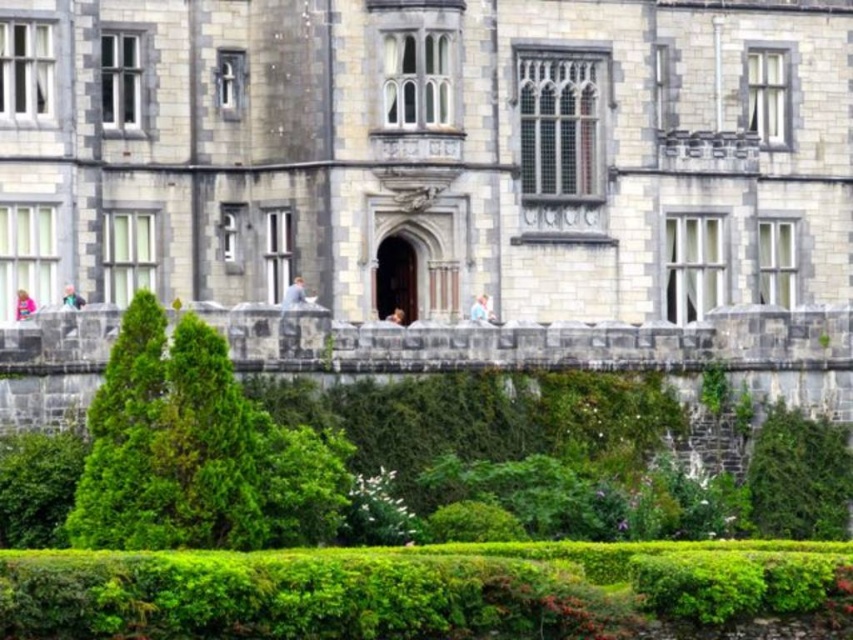
Question: Among these points, which one is farthest from the camera?

Choices:
 (A) (173, 486)
 (B) (814, 444)
 (C) (27, 460)

Answer: (B)

Question: Which of the following is the closest to the observer?

Choices:
 (A) (135, 470)
 (B) (39, 481)

Answer: (A)

Question: Can you confirm if green leafy bush at lower right is thinner than green leafy bush at lower left?

Choices:
 (A) no
 (B) yes

Answer: (A)

Question: Does green leafy tree at lower left have a lesser width compared to green leafy bush at lower right?

Choices:
 (A) yes
 (B) no

Answer: (A)

Question: Which of the following is the closest to the observer?

Choices:
 (A) green leafy bush at lower left
 (B) green leafy bush at lower right
 (C) green leafy tree at lower left

Answer: (C)

Question: Where is green leafy tree at lower left located in relation to green leafy bush at lower right in the image?

Choices:
 (A) below
 (B) above

Answer: (B)